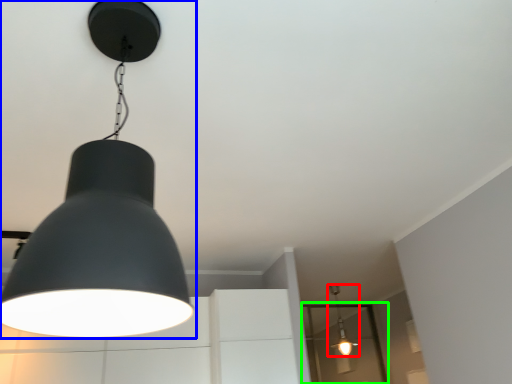
Question: Which is farther away from lamp (highlighted by a red box)? lamp (highlighted by a blue box) or glass door (highlighted by a green box)?

Choices:
 (A) lamp
 (B) glass door

Answer: (A)